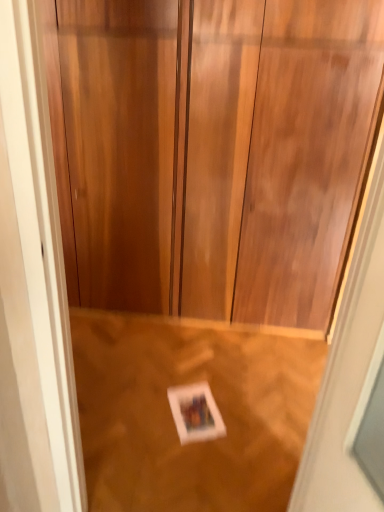
Locate an element on the screen. The image size is (384, 512). vacant area located to the right-hand side of white paper at center is located at coordinates (239, 409).